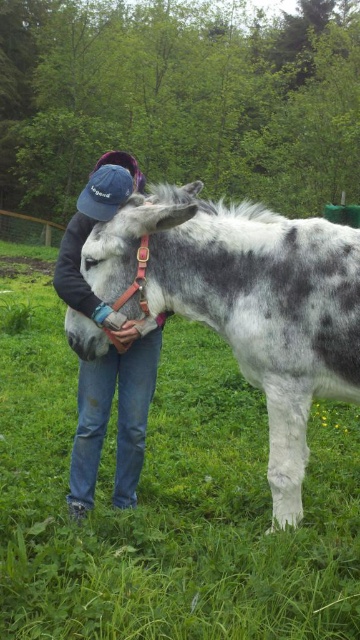
Can you confirm if spotted fur mule at center is bigger than denim cap at center?

Yes, spotted fur mule at center is bigger than denim cap at center.

The height and width of the screenshot is (640, 360). I want to click on spotted fur mule at center, so click(x=249, y=301).

Where is `spotted fur mule at center`? Image resolution: width=360 pixels, height=640 pixels. spotted fur mule at center is located at coordinates (249, 301).